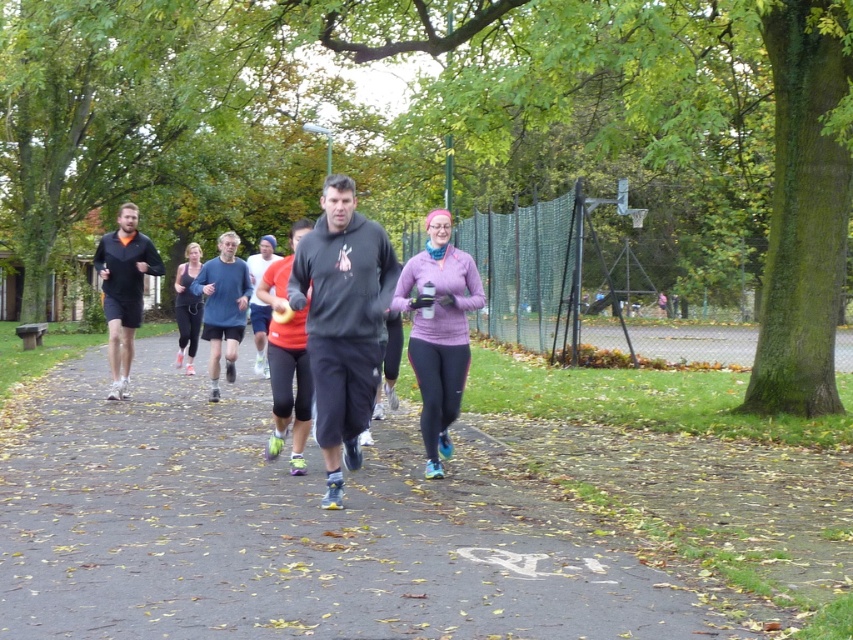
Can you confirm if smooth asphalt path at center is smaller than matte black shorts at left?

No, smooth asphalt path at center is not smaller than matte black shorts at left.

Can you confirm if smooth asphalt path at center is taller than matte black shorts at left?

No.

Between point (451, 464) and point (120, 378), which one is positioned behind?

Positioned behind is point (120, 378).

This screenshot has width=853, height=640. I want to click on smooth asphalt path at center, so click(289, 531).

The width and height of the screenshot is (853, 640). In order to click on matte black leggings at center in this screenshot , I will do `click(187, 307)`.

Which is behind, point (195, 305) or point (260, 355)?

The point (260, 355) is more distant.

Is point (189, 253) farther from camera compared to point (271, 259)?

Yes, point (189, 253) is farther from viewer.

This screenshot has width=853, height=640. I want to click on matte black leggings at center, so click(x=187, y=307).

Which is behind, point (108, 305) or point (218, 376)?

Positioned behind is point (218, 376).

Is matte black shorts at left taller than matte blue top at center?

Correct, matte black shorts at left is much taller as matte blue top at center.

Is point (117, 240) in front of point (230, 284)?

Yes, point (117, 240) is in front of point (230, 284).

At what (x,y) coordinates should I click in order to perform the action: click on matte black shorts at left. Please return your answer as a coordinate pair (x, y). The width and height of the screenshot is (853, 640). Looking at the image, I should click on (123, 289).